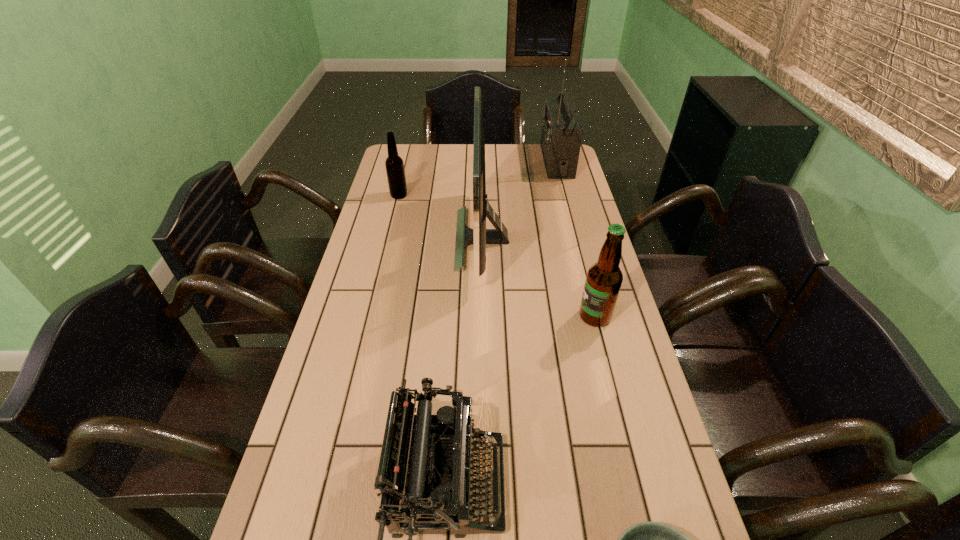
Where is `object that is the fifth closest to the typewriter`? The image size is (960, 540). object that is the fifth closest to the typewriter is located at coordinates tap(561, 136).

Locate which object ranks in proximity to the third tallest object. Please provide its 2D coordinates. Your answer should be formatted as a tuple, i.e. [(x, y)], where the tuple contains the x and y coordinates of a point satisfying the conditions above.

[(479, 236)]